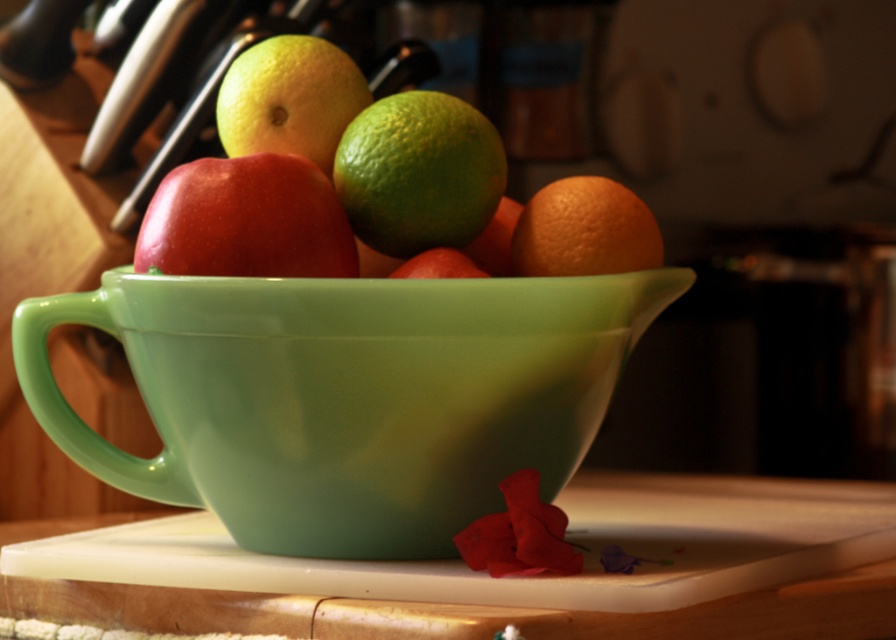
You have a small container that can only hold items narrower than the glossy ceramic bowl at center. Can the orange matte at right fit into the container?

The glossy ceramic bowl at center is wider than the orange matte at right, so the orange matte at right can fit into the container since it is narrower than the bowl.

You are a chef preparing a fruit salad and need to reach for the orange matte at right. Which object is closer to your hand if you are standing in front of the glossy ceramic bowl at center?

The glossy ceramic bowl at center is closer to the viewer than the orange matte at right, so the bowl is closer to your hand.

Looking at this image, you are preparing to cut the glossy red apple at center and need to place it on the white plastic cutting board at lower center. Based on their sizes, will the apple fit entirely on the board?

The white plastic cutting board at lower center might be wider than glossy red apple at center, so there is a possibility that the apple will fit, but it depends on the exact dimensions.